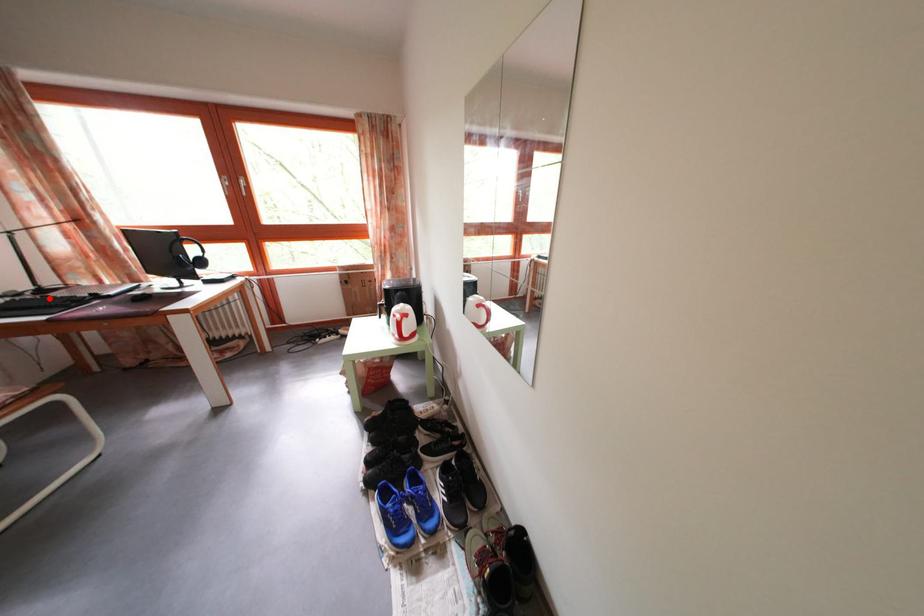
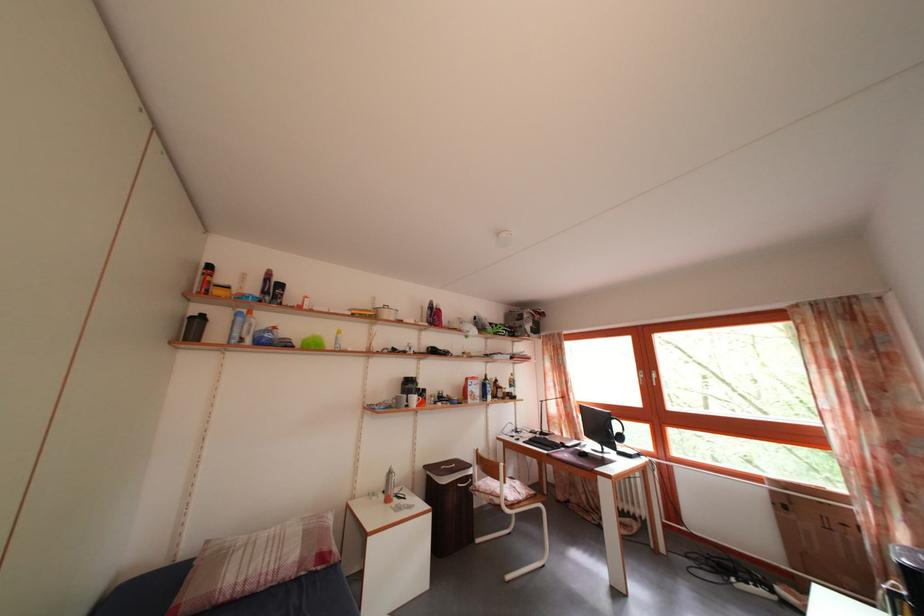
In the second image, find the point that corresponds to the highlighted location in the first image.

(550, 440)